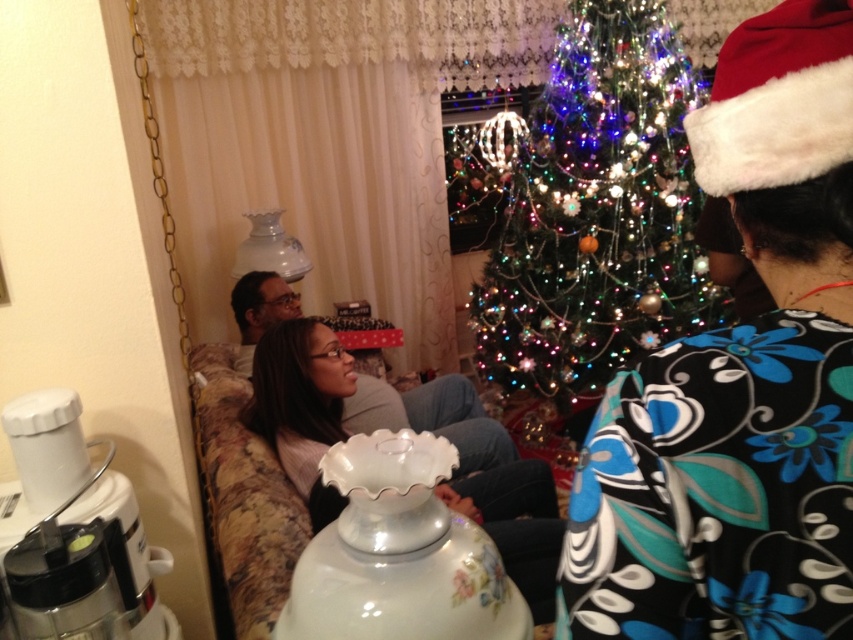
Question: Which of these objects is positioned closest to the floral-patterned fabric couch at center?

Choices:
 (A) black floral dress at center
 (B) matte white blender at lower left
 (C) iridescent glass christmas tree at center

Answer: (B)

Question: Can you confirm if black floral dress at center is bigger than matte white blender at lower left?

Choices:
 (A) yes
 (B) no

Answer: (A)

Question: Is iridescent glass christmas tree at center behind floral-patterned fabric couch at center?

Choices:
 (A) yes
 (B) no

Answer: (A)

Question: Among these objects, which one is farthest from the camera?

Choices:
 (A) iridescent glass christmas tree at center
 (B) matte white blender at lower left
 (C) floral-patterned fabric couch at center

Answer: (A)

Question: Which object is the farthest from the matte white blender at lower left?

Choices:
 (A) floral-patterned fabric couch at center
 (B) iridescent glass christmas tree at center

Answer: (B)

Question: Does black floral dress at center have a greater width compared to matte white blender at lower left?

Choices:
 (A) yes
 (B) no

Answer: (A)